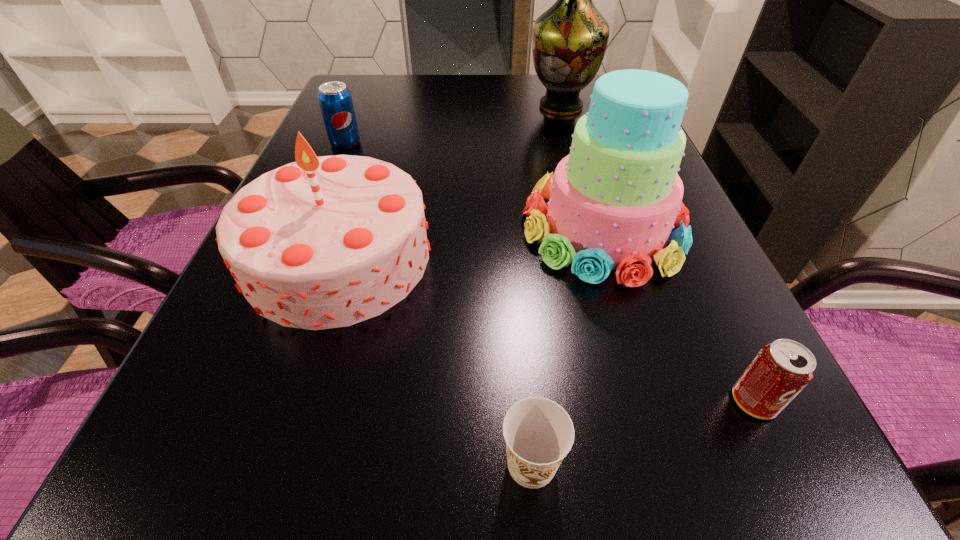
Identify the location of vacant space in between the nearer soda can and the birthday cake. Image resolution: width=960 pixels, height=540 pixels. (546, 329).

Identify the location of empty location between the right soda can and the taller soda can. (550, 272).

This screenshot has width=960, height=540. Find the location of `vacant area that lies between the cake and the left soda can`. vacant area that lies between the cake and the left soda can is located at coordinates (474, 185).

The height and width of the screenshot is (540, 960). In order to click on free space between the nearer soda can and the cake in this screenshot , I will do `click(679, 314)`.

Find the location of `free area in between the fifth nearest object and the farthest object`. free area in between the fifth nearest object and the farthest object is located at coordinates (453, 124).

Locate an element on the screen. This screenshot has height=540, width=960. vacant space that's between the tallest object and the fifth nearest object is located at coordinates (453, 124).

This screenshot has height=540, width=960. I want to click on free spot between the birthday cake and the shortest object, so point(435,360).

Identify which object is the fourth closest to the nearest object. Please provide its 2D coordinates. Your answer should be formatted as a tuple, i.e. [(x, y)], where the tuple contains the x and y coordinates of a point satisfying the conditions above.

[(335, 100)]

What are the coordinates of `the second closest object to the cake` in the screenshot? It's located at (781, 370).

This screenshot has height=540, width=960. What are the coordinates of `free spot that satisfies the following two spatial constraints: 1. on the front side of the right soda can; 2. on the left side of the birthday cake` in the screenshot? It's located at (292, 401).